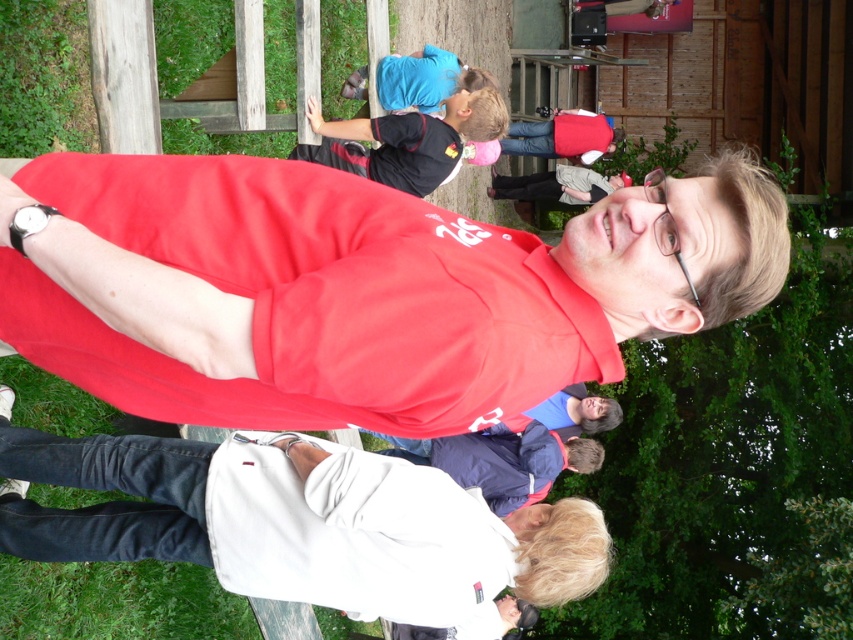
You are a photographer trying to decide which of the two items at the center of the image, the matte red shirt at center and the white matte jacket at center, would be easier to capture in a tight frame. Which one should you choose and why?

The matte red shirt at center is thinner than the white matte jacket at center, so it would be easier to capture the matte red shirt at center in a tight frame because it has a smaller width.

Based on the scene description, can you determine which object is bigger between the white matte jacket at center and the black jersey at upper center?

The white matte jacket at center is larger in size than the black jersey at upper center.